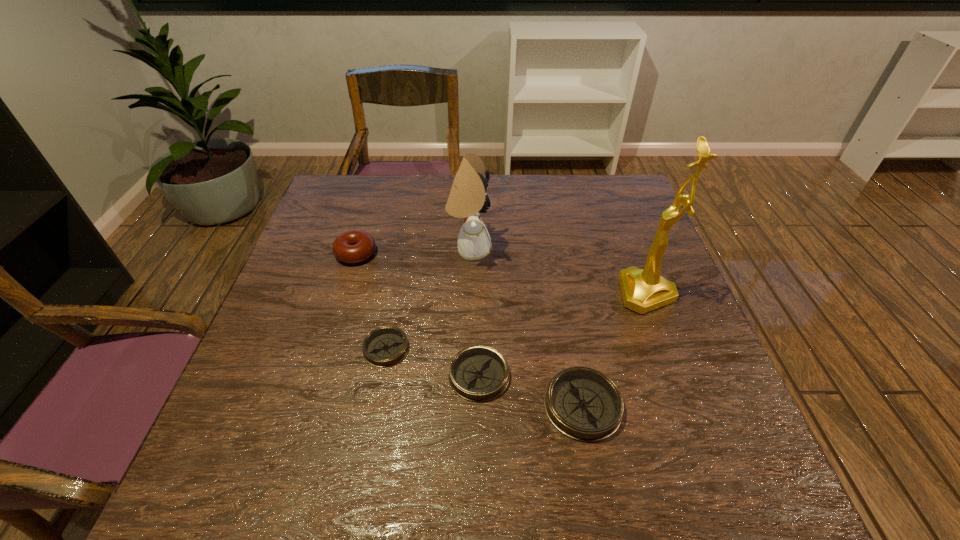
This screenshot has width=960, height=540. Find the location of `the shortest compass`. the shortest compass is located at coordinates tap(386, 346).

Find the location of a particular element. the fifth object from right to left is located at coordinates (386, 346).

Find the location of a particular element. the fifth tallest object is located at coordinates (478, 373).

At what (x,y) coordinates should I click in order to perform the action: click on the second shortest compass. Please return your answer as a coordinate pair (x, y). The width and height of the screenshot is (960, 540). Looking at the image, I should click on (478, 373).

At what (x,y) coordinates should I click in order to perform the action: click on the third shortest object. Please return your answer as a coordinate pair (x, y). This screenshot has width=960, height=540. Looking at the image, I should click on (584, 404).

Where is `the fifth object from left to right`? the fifth object from left to right is located at coordinates (584, 404).

At what (x,y) coordinates should I click in order to perform the action: click on the second tallest object. Please return your answer as a coordinate pair (x, y). Image resolution: width=960 pixels, height=540 pixels. Looking at the image, I should click on (467, 198).

Locate an element on the screen. The height and width of the screenshot is (540, 960). doughnut is located at coordinates (354, 246).

Locate an element on the screen. The height and width of the screenshot is (540, 960). the third tallest object is located at coordinates (354, 246).

The image size is (960, 540). What are the coordinates of `the tallest object` in the screenshot? It's located at [643, 290].